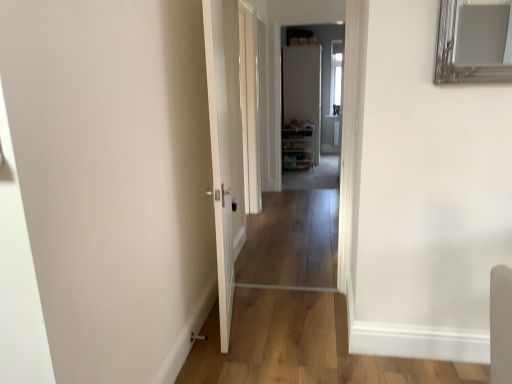
At what (x,y) coordinates should I click in order to perform the action: click on free spot in front of white glossy door at center, which appears as the second door when viewed from the right. Please return your answer as a coordinate pair (x, y). Image resolution: width=512 pixels, height=384 pixels. Looking at the image, I should click on (243, 359).